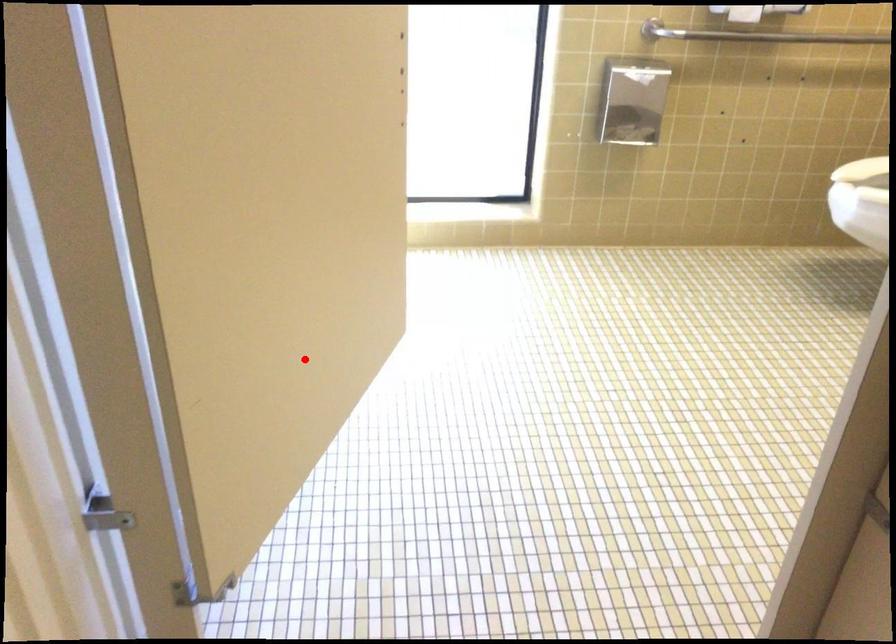
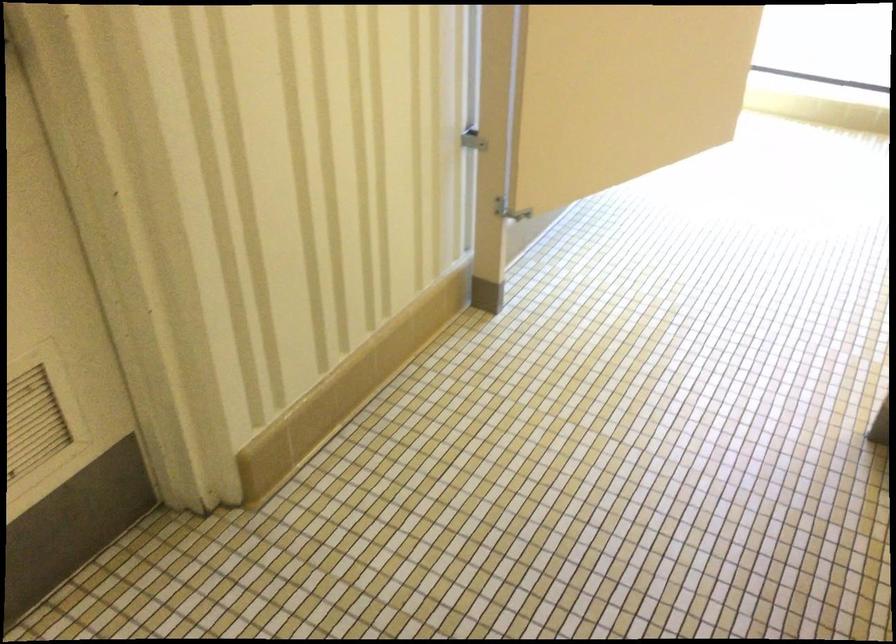
The point at the highlighted location is marked in the first image. Where is the corresponding point in the second image?

(623, 91)